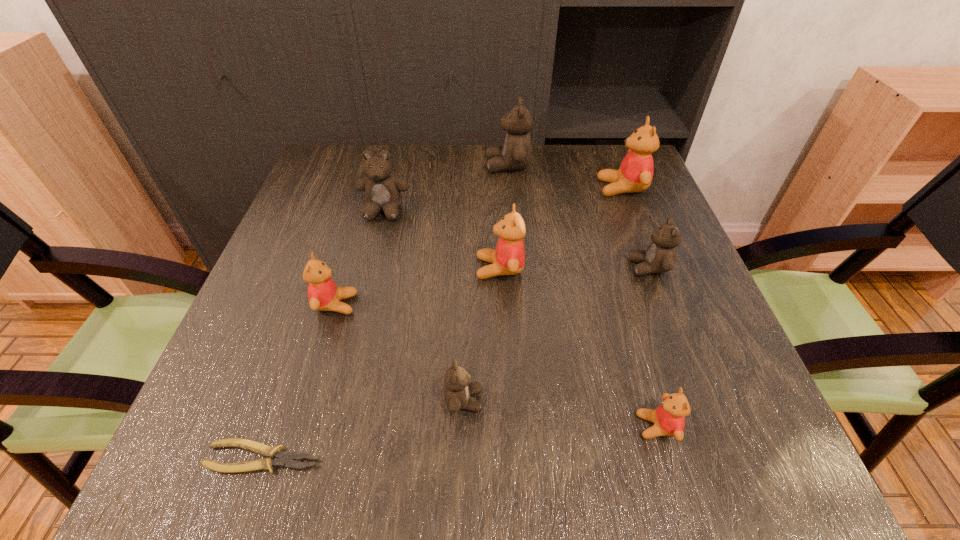
At what (x,y) coordinates should I click in order to perform the action: click on the second brown teddy bear from left to right. Please return your answer as a coordinate pair (x, y). Looking at the image, I should click on (458, 387).

Find the location of `the smallest red teddy bear`. the smallest red teddy bear is located at coordinates (669, 418).

I want to click on yellow pliers, so point(283,459).

The image size is (960, 540). Find the location of `the shortest object`. the shortest object is located at coordinates (283, 459).

The image size is (960, 540). Identify the location of free spot located on the face of the second brown teddy bear from right to left. (394, 166).

At what (x,y) coordinates should I click in order to perform the action: click on blank space located on the face of the second brown teddy bear from right to left. Please return your answer as a coordinate pair (x, y). The image size is (960, 540). Looking at the image, I should click on (378, 166).

This screenshot has height=540, width=960. Find the location of `vacant point located 0.160m on the face of the second brown teddy bear from right to left`. vacant point located 0.160m on the face of the second brown teddy bear from right to left is located at coordinates (426, 166).

Where is `vacant space situated on the front-facing side of the biggest red teddy bear`? The image size is (960, 540). vacant space situated on the front-facing side of the biggest red teddy bear is located at coordinates (575, 188).

Find the location of `vacant region located 0.240m on the front-facing side of the biggest red teddy bear`. vacant region located 0.240m on the front-facing side of the biggest red teddy bear is located at coordinates point(505,188).

Locate an element on the screen. The width and height of the screenshot is (960, 540). vacant space positioned on the front-facing side of the biggest red teddy bear is located at coordinates (466, 188).